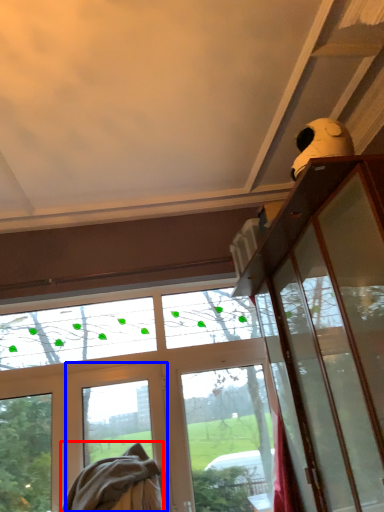
Question: Which point is further to the camera, blanket (highlighted by a red box) or screen door (highlighted by a blue box)?

Choices:
 (A) blanket
 (B) screen door

Answer: (B)